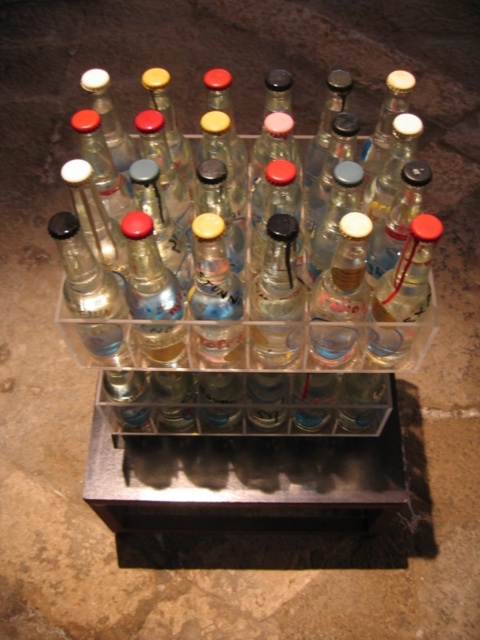
Question: Which of the following is the closest to the observer?

Choices:
 (A) (291, 218)
 (B) (168, 205)

Answer: (A)

Question: Which object is closer to the camera taking this photo?

Choices:
 (A) clear glass bottles at center
 (B) clear glass bottle at center

Answer: (B)

Question: Can you confirm if clear glass bottles at center is wider than clear glass bottle at center?

Choices:
 (A) yes
 (B) no

Answer: (A)

Question: Which object appears closest to the camera in this image?

Choices:
 (A) clear glass bottles at center
 (B) clear glass bottle at center

Answer: (B)

Question: In this image, where is clear glass bottles at center located relative to clear glass bottle at center?

Choices:
 (A) left
 (B) right

Answer: (A)

Question: Is clear glass bottles at center behind clear glass bottle at center?

Choices:
 (A) yes
 (B) no

Answer: (A)